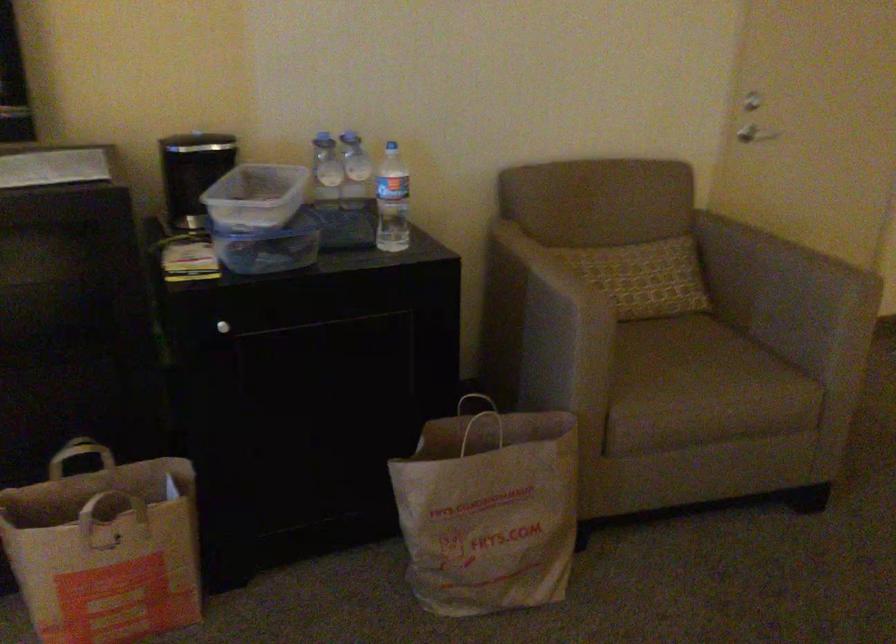
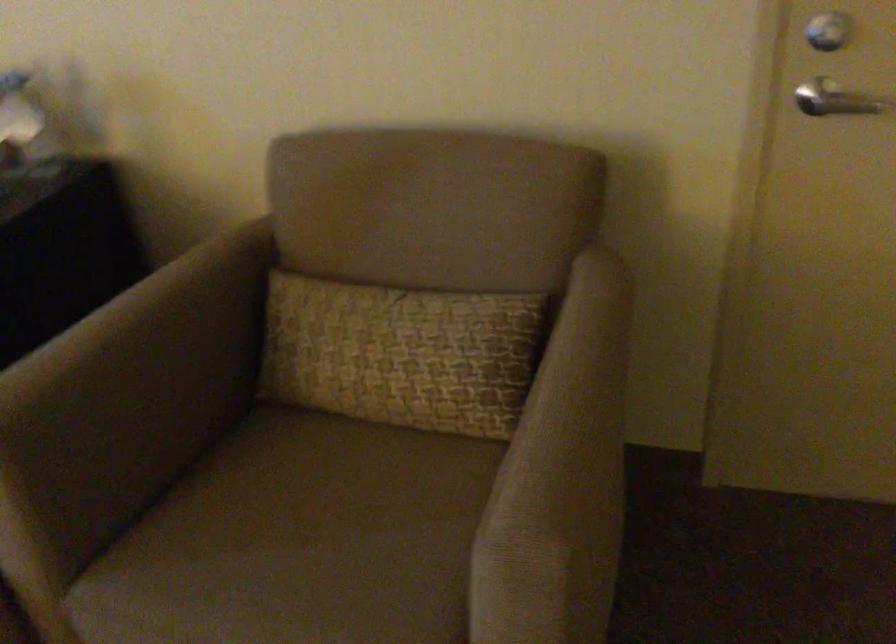
Find the pixel in the second image that matches point (645, 272) in the first image.

(401, 353)